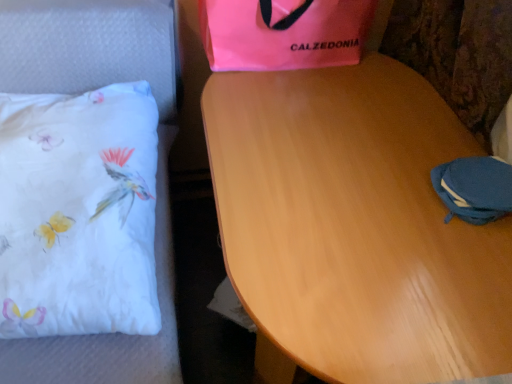
Identify the location of free space behind blue fabric pouch at lower right. The width and height of the screenshot is (512, 384). (432, 134).